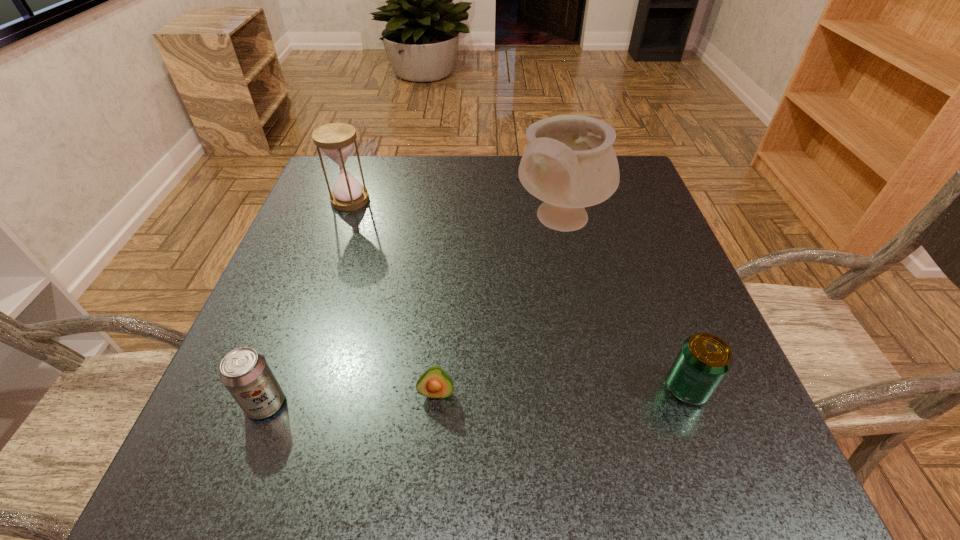
Locate an element on the screen. pottery is located at coordinates (569, 163).

You are a GUI agent. You are given a task and a screenshot of the screen. Output one action in this format:
    pyautogui.click(x=<x>, y=<y>)
    Task: Click on the tallest object
    
    Given the screenshot: What is the action you would take?
    pyautogui.click(x=569, y=163)

I want to click on the second tallest object, so click(x=336, y=140).

Where is `the left beer can`? This screenshot has height=540, width=960. the left beer can is located at coordinates (246, 374).

Where is `the right beer can`? This screenshot has height=540, width=960. the right beer can is located at coordinates (704, 359).

The width and height of the screenshot is (960, 540). In order to click on avocado in this screenshot , I will do `click(436, 383)`.

Find the location of a particular element. This screenshot has width=960, height=540. the shortest object is located at coordinates (436, 383).

This screenshot has height=540, width=960. In order to click on vacant region located 0.130m on the left of the tallest object in this screenshot , I will do `click(456, 222)`.

Where is `vacant space located on the back of the fourth shortest object`? The width and height of the screenshot is (960, 540). vacant space located on the back of the fourth shortest object is located at coordinates (360, 172).

At what (x,y) coordinates should I click in order to perform the action: click on vacant space located on the front of the left beer can. Please return your answer as a coordinate pair (x, y). Looking at the image, I should click on (232, 492).